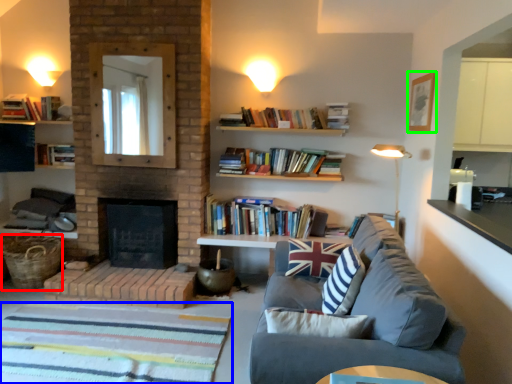
Question: Which object is positioned farthest from basket (highlighted by a red box)? Select from flat (highlighted by a blue box) and picture frame (highlighted by a green box).

Choices:
 (A) flat
 (B) picture frame

Answer: (B)